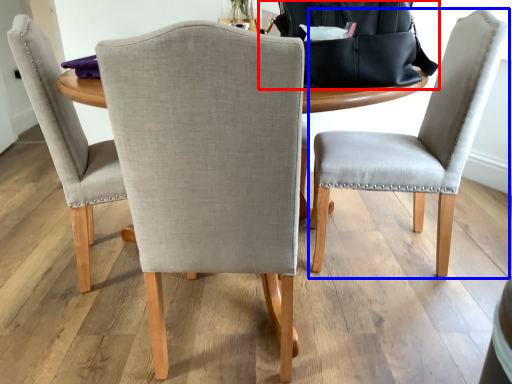
Question: Which object appears farthest to the camera in this image, messenger bag (highlighted by a red box) or chair (highlighted by a blue box)?

Choices:
 (A) messenger bag
 (B) chair

Answer: (B)